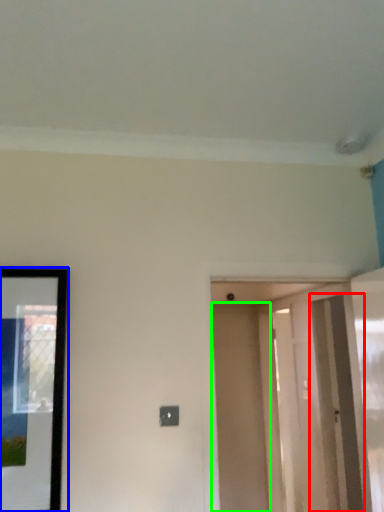
Question: Which is nearer to the screen door (highlighted by a red box)? picture frame (highlighted by a blue box) or door (highlighted by a green box).

Choices:
 (A) picture frame
 (B) door

Answer: (B)